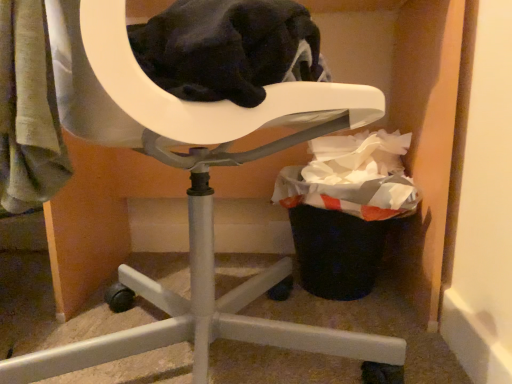
The width and height of the screenshot is (512, 384). In order to click on black plastic laundry basket at lower right in this screenshot , I will do `click(345, 209)`.

This screenshot has width=512, height=384. Describe the element at coordinates (345, 209) in the screenshot. I see `black plastic laundry basket at lower right` at that location.

You are a GUI agent. You are given a task and a screenshot of the screen. Output one action in this format:
    pyautogui.click(x=<x>, y=<y>)
    Task: Click on the black plastic laundry basket at lower right
    The image size is (512, 384).
    Given the screenshot: What is the action you would take?
    pyautogui.click(x=345, y=209)